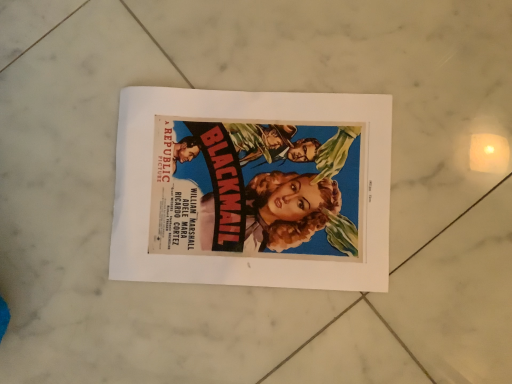
The image size is (512, 384). Describe the element at coordinates (252, 189) in the screenshot. I see `matte paper poster at center` at that location.

This screenshot has width=512, height=384. In order to click on matte paper poster at center in this screenshot , I will do `click(252, 189)`.

The image size is (512, 384). In order to click on matte paper poster at center in this screenshot , I will do `click(252, 189)`.